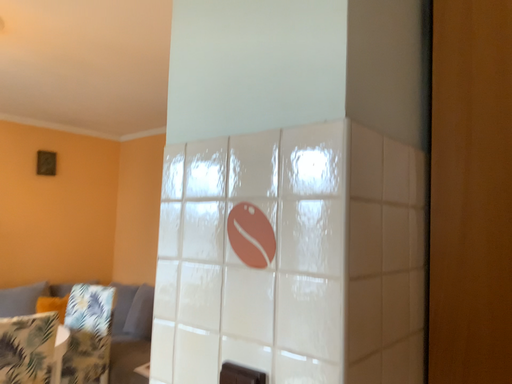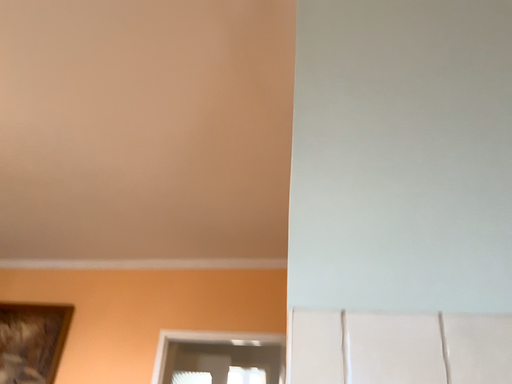
Question: Which way did the camera rotate in the video?

Choices:
 (A) rotated downward
 (B) rotated upward

Answer: (B)